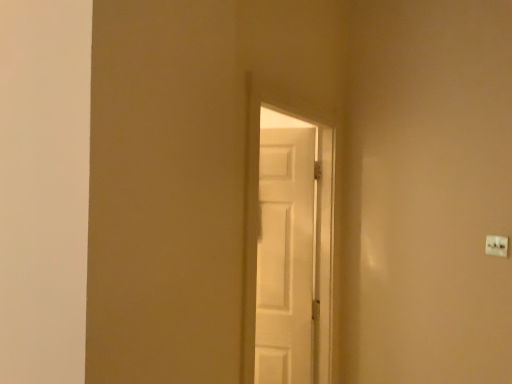
Question: From the image's perspective, relative to white plastic light switch at upper right, is white matte door at center above or below?

Choices:
 (A) below
 (B) above

Answer: (A)

Question: Is white matte door at center in front of or behind white plastic light switch at upper right in the image?

Choices:
 (A) front
 (B) behind

Answer: (A)

Question: In terms of size, does white matte door at center appear bigger or smaller than white plastic light switch at upper right?

Choices:
 (A) big
 (B) small

Answer: (A)

Question: Looking at the image, does white plastic light switch at upper right seem bigger or smaller compared to white matte door at center?

Choices:
 (A) small
 (B) big

Answer: (A)

Question: From the image's perspective, relative to white matte door at center, is white plastic light switch at upper right above or below?

Choices:
 (A) below
 (B) above

Answer: (B)

Question: Looking at their shapes, would you say white plastic light switch at upper right is wider or thinner than white matte door at center?

Choices:
 (A) thin
 (B) wide

Answer: (A)

Question: From a real-world perspective, relative to white matte door at center, is white plastic light switch at upper right vertically above or below?

Choices:
 (A) below
 (B) above

Answer: (B)